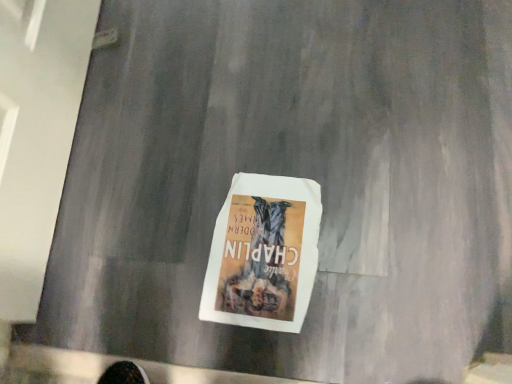
The width and height of the screenshot is (512, 384). Identify the location of vacant space in front of white paper at center. (315, 340).